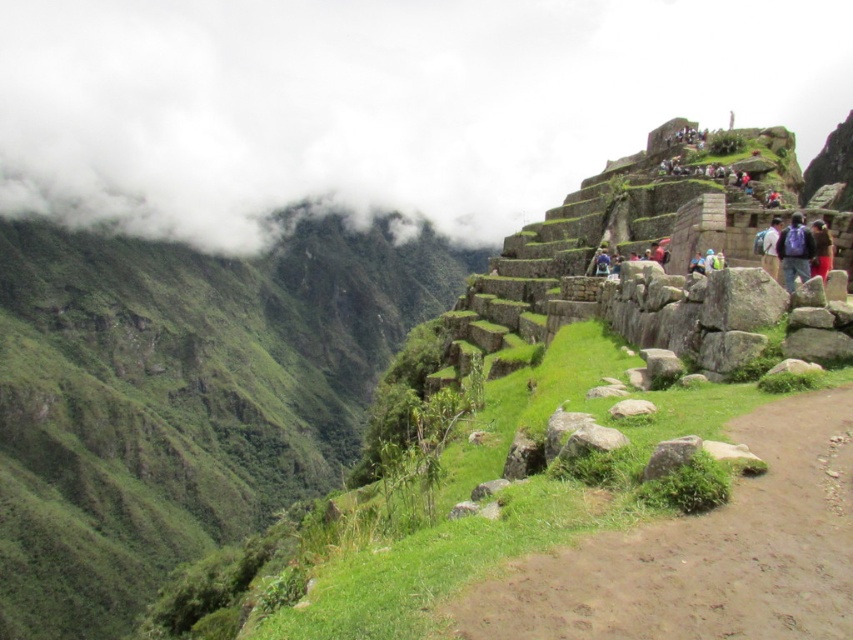
Is white fluffy cloud at upper left wider than brown dirt path at center?

Correct, the width of white fluffy cloud at upper left exceeds that of brown dirt path at center.

Is white fluffy cloud at upper left positioned in front of brown dirt path at center?

No, white fluffy cloud at upper left is further to the viewer.

Does point (239, 54) lie in front of point (560, 566)?

No, it is behind (560, 566).

Identify the location of white fluffy cloud at upper left. (381, 102).

Who is higher up, blue backpack at upper right or smooth gray rock at center-right?

Positioned higher is blue backpack at upper right.

Identify the location of blue backpack at upper right. (795, 252).

Locate an element on the screen. The height and width of the screenshot is (640, 853). blue backpack at upper right is located at coordinates (795, 252).

Which is below, white fluffy cloud at upper left or blue backpack at upper right?

blue backpack at upper right is lower down.

Where is `white fluffy cloud at upper left`? white fluffy cloud at upper left is located at coordinates (381, 102).